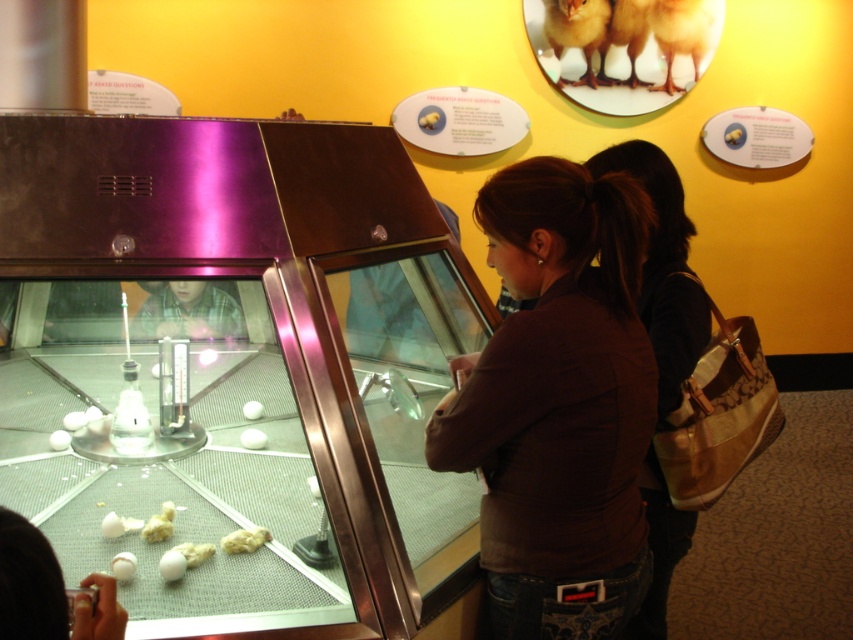
Can you confirm if brown fabric shirt at center is taller than brown fabric purse at center?

Incorrect, brown fabric shirt at center's height is not larger of brown fabric purse at center's.

Identify the location of brown fabric shirt at center. This screenshot has width=853, height=640. (558, 404).